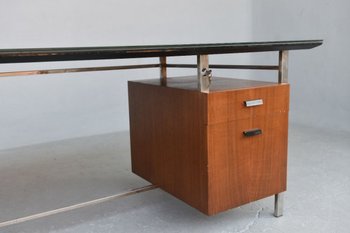
I want to click on file drawer, so click(233, 164).